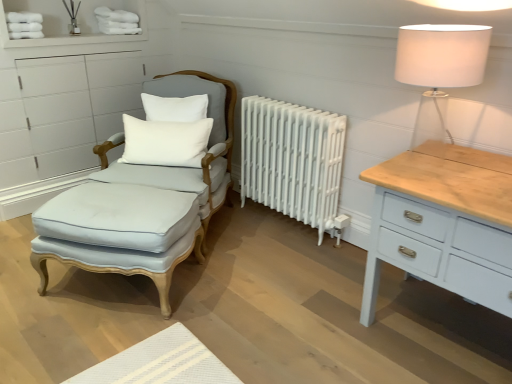
You are a GUI agent. You are given a task and a screenshot of the screen. Output one action in this format:
    pyautogui.click(x=<x>, y=<y>)
    Task: Click on the empty space that is to the right of light blue fabric swivel chair at left
    This screenshot has width=512, height=384.
    Given the screenshot: What is the action you would take?
    pyautogui.click(x=274, y=244)